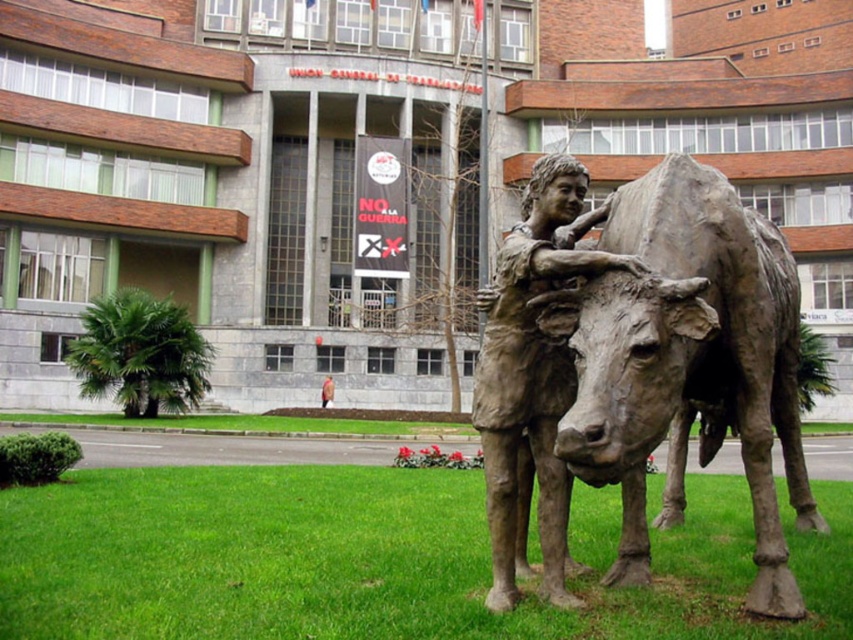
Question: Is green grass at lower center thinner than bronze statue at center?

Choices:
 (A) no
 (B) yes

Answer: (B)

Question: Does green grass at lower center come behind bronze statue at center?

Choices:
 (A) yes
 (B) no

Answer: (B)

Question: Is green grass at lower center wider than bronze statue at center?

Choices:
 (A) yes
 (B) no

Answer: (B)

Question: Which object is farther from the camera taking this photo?

Choices:
 (A) bronze statue at center
 (B) green grass at lower center

Answer: (A)